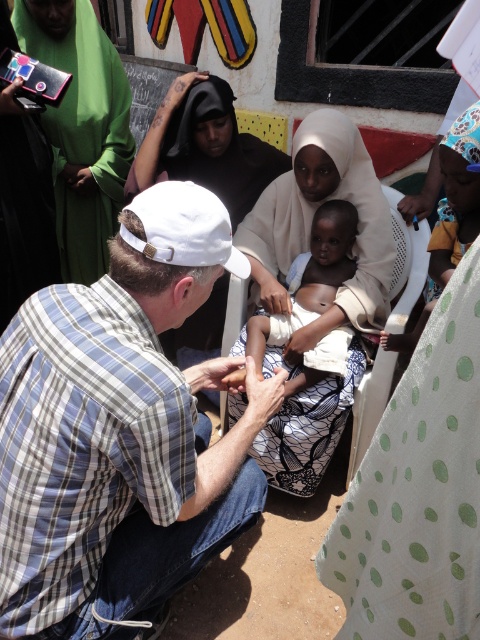
Question: Based on their relative distances, which object is nearer to the white lace dress at center?

Choices:
 (A) plaid cotton shirt at center
 (B) light skin baby at center

Answer: (B)

Question: Where is white lace dress at center located in relation to light skin baby at center in the image?

Choices:
 (A) left
 (B) right

Answer: (A)

Question: Estimate the real-world distances between objects in this image. Which object is closer to the light skin baby at center?

Choices:
 (A) plaid cotton shirt at center
 (B) white lace dress at center

Answer: (B)

Question: Does plaid cotton shirt at center appear on the right side of white lace dress at center?

Choices:
 (A) yes
 (B) no

Answer: (B)

Question: Which object is closer to the camera taking this photo?

Choices:
 (A) plaid cotton shirt at center
 (B) white lace dress at center

Answer: (A)

Question: In this image, where is plaid cotton shirt at center located relative to white lace dress at center?

Choices:
 (A) above
 (B) below

Answer: (B)